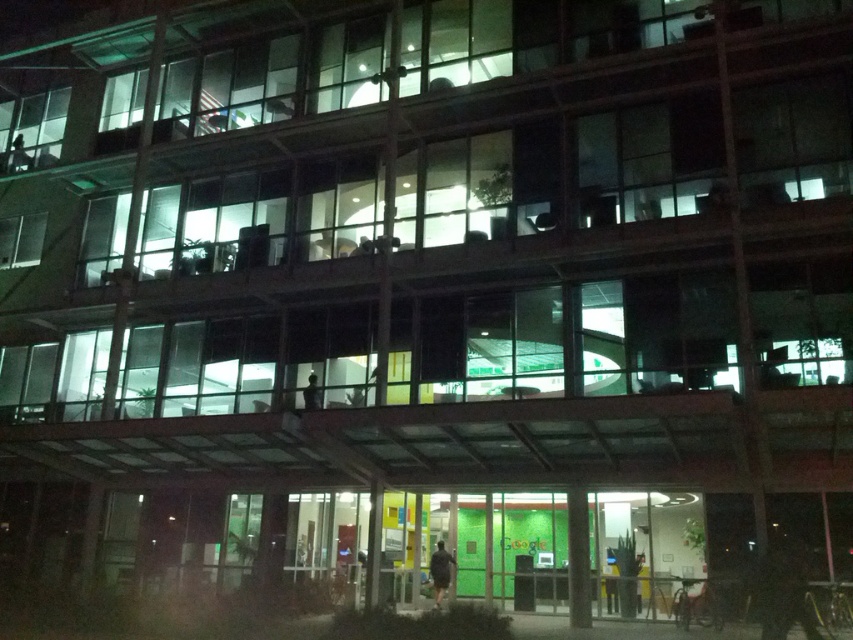
Is point (450, 556) positioned before point (305, 396)?

Yes, it is in front of point (305, 396).

This screenshot has width=853, height=640. What do you see at coordinates (440, 572) in the screenshot?
I see `dark gray fabric jacket at lower center` at bounding box center [440, 572].

Where is `dark gray fabric jacket at lower center`? Image resolution: width=853 pixels, height=640 pixels. dark gray fabric jacket at lower center is located at coordinates (440, 572).